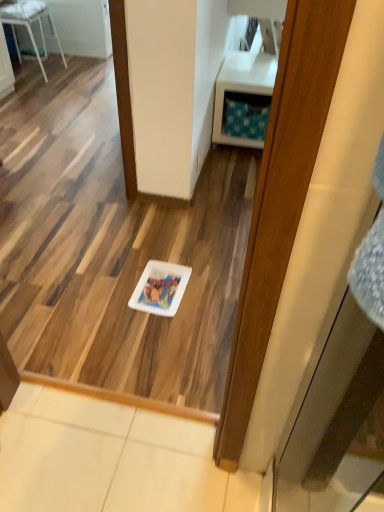
Question: Considering the positions of white glossy plate at center and white glossy chair at upper left in the image, is white glossy plate at center bigger or smaller than white glossy chair at upper left?

Choices:
 (A) big
 (B) small

Answer: (B)

Question: Looking at their shapes, would you say white glossy plate at center is wider or thinner than white glossy chair at upper left?

Choices:
 (A) thin
 (B) wide

Answer: (A)

Question: Which object is positioned farthest from the white glossy plate at center?

Choices:
 (A) white plastic vanity at upper right
 (B) white glossy chair at upper left

Answer: (B)

Question: Which object is positioned farthest from the white plastic vanity at upper right?

Choices:
 (A) white glossy chair at upper left
 (B) white glossy plate at center

Answer: (A)